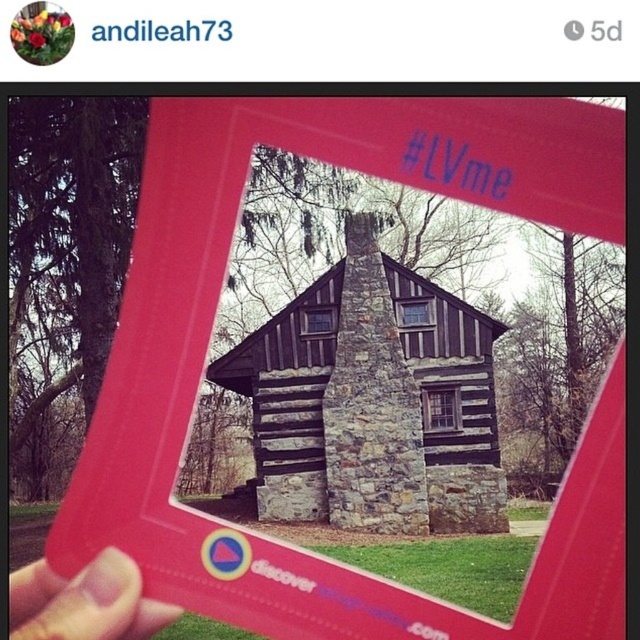
Question: In this image, where is dark brown wood log cabin at center located relative to flesh-toned skin at lower left?

Choices:
 (A) left
 (B) right

Answer: (B)

Question: Which point is farther from the camera taking this photo?

Choices:
 (A) (109, 616)
 (B) (340, 493)

Answer: (B)

Question: Among these points, which one is nearest to the camera?

Choices:
 (A) (308, 444)
 (B) (19, 636)

Answer: (B)

Question: Is dark brown wood log cabin at center smaller than flesh-toned skin at lower left?

Choices:
 (A) yes
 (B) no

Answer: (B)

Question: Does dark brown wood log cabin at center come behind flesh-toned skin at lower left?

Choices:
 (A) yes
 (B) no

Answer: (A)